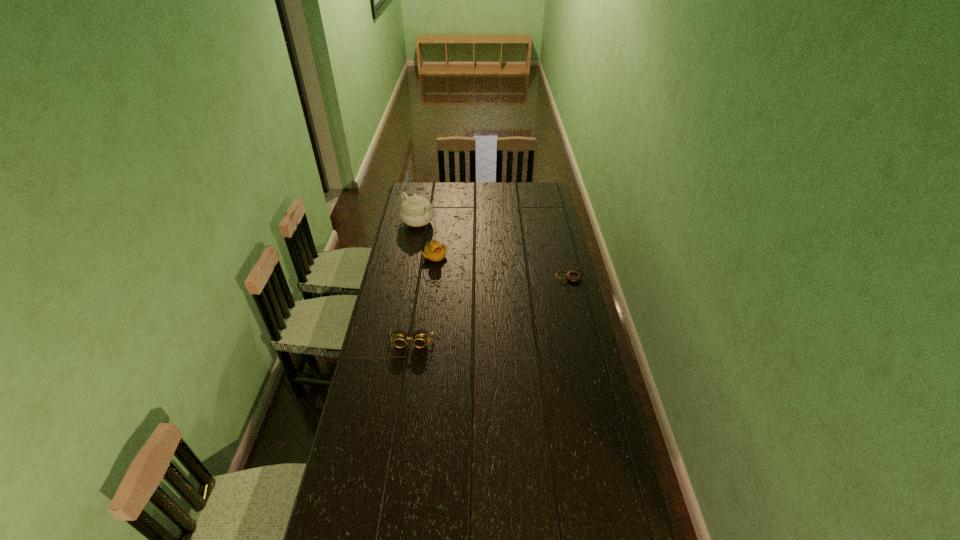
Locate an element on the screen. vacant position located on the front-facing side of the duckling is located at coordinates (466, 279).

You are a GUI agent. You are given a task and a screenshot of the screen. Output one action in this format:
    pyautogui.click(x=<x>, y=<y>)
    Task: Click on the free region located on the front-facing side of the duckling
    This screenshot has height=540, width=960.
    Given the screenshot: What is the action you would take?
    pyautogui.click(x=468, y=280)

Locate an element on the screen. vacant region located on the spout of the tallest object is located at coordinates (439, 238).

Identify the location of blank space located 0.200m on the spout of the tallest object. This screenshot has width=960, height=540. (450, 246).

This screenshot has height=540, width=960. What are the coordinates of `free point located 0.400m on the spout of the tallest object` in the screenshot? It's located at (474, 264).

Where is `goggles that is at the left edge`? Image resolution: width=960 pixels, height=540 pixels. goggles that is at the left edge is located at coordinates (419, 338).

The height and width of the screenshot is (540, 960). Identify the location of duckling at the left edge. (433, 251).

I want to click on chinaware at the left edge, so click(x=415, y=211).

What are the coordinates of `object that is at the right edge` in the screenshot? It's located at (572, 276).

Find the location of a particular element. The width and height of the screenshot is (960, 540). vacant space at the far edge of the desktop is located at coordinates (442, 186).